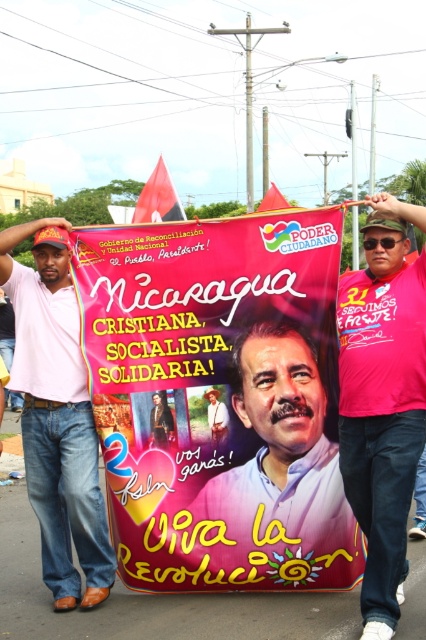
Which is more to the left, pink fabric shirt at center or pink cotton shirt at left?

Positioned to the left is pink cotton shirt at left.

Describe the element at coordinates (382, 400) in the screenshot. I see `pink fabric shirt at center` at that location.

What are the coordinates of `pink fabric shirt at center` in the screenshot? It's located at (382, 400).

Is pink paper poster at center smaller than matte pink shirt at center?

No.

Between point (112, 346) and point (287, 412), which one is positioned behind?

The point (112, 346) is behind.

Where is `pink paper poster at center`? pink paper poster at center is located at coordinates 219,401.

At what (x,y) coordinates should I click in order to perform the action: click on pink paper poster at center. Please return your answer as a coordinate pair (x, y). This screenshot has height=640, width=426. Looking at the image, I should click on (219, 401).

Between matte pink shirt at center and pink cotton shirt at left, which one appears on the left side from the viewer's perspective?

Positioned to the left is pink cotton shirt at left.

Can you confirm if matte pink shirt at center is thinner than pink cotton shirt at left?

In fact, matte pink shirt at center might be wider than pink cotton shirt at left.

Between point (242, 518) and point (65, 552), which one is positioned in front?

Point (65, 552) is more forward.

Where is `matte pink shirt at center`? This screenshot has width=426, height=640. matte pink shirt at center is located at coordinates (282, 472).